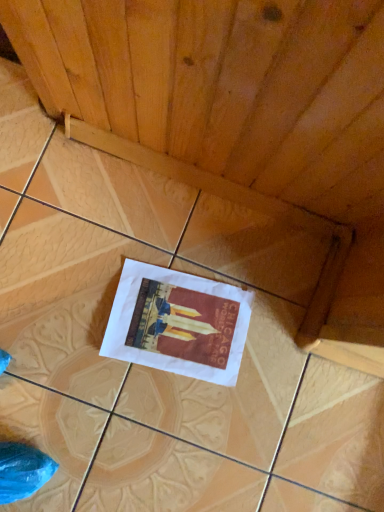
Question: Are wooden at center and white paper poster at center beside each other?

Choices:
 (A) no
 (B) yes

Answer: (A)

Question: From a real-world perspective, is wooden at center over white paper poster at center?

Choices:
 (A) yes
 (B) no

Answer: (B)

Question: From the image's perspective, is wooden at center located beneath white paper poster at center?

Choices:
 (A) yes
 (B) no

Answer: (B)

Question: Does wooden at center have a greater height compared to white paper poster at center?

Choices:
 (A) no
 (B) yes

Answer: (B)

Question: Does wooden at center appear on the left side of white paper poster at center?

Choices:
 (A) no
 (B) yes

Answer: (B)

Question: From a real-world perspective, is wooden at center under white paper poster at center?

Choices:
 (A) no
 (B) yes

Answer: (B)

Question: Is white paper poster at center directly adjacent to wooden at center?

Choices:
 (A) no
 (B) yes

Answer: (A)

Question: Is white paper poster at center looking in the opposite direction of wooden at center?

Choices:
 (A) yes
 (B) no

Answer: (A)

Question: Can we say white paper poster at center lies outside wooden at center?

Choices:
 (A) yes
 (B) no

Answer: (B)

Question: From the image's perspective, does white paper poster at center appear lower than wooden at center?

Choices:
 (A) no
 (B) yes

Answer: (B)

Question: Can you confirm if white paper poster at center is smaller than wooden at center?

Choices:
 (A) yes
 (B) no

Answer: (A)

Question: Is white paper poster at center taller than wooden at center?

Choices:
 (A) yes
 (B) no

Answer: (B)

Question: Would you say wooden at center is inside or outside white paper poster at center?

Choices:
 (A) inside
 (B) outside

Answer: (B)